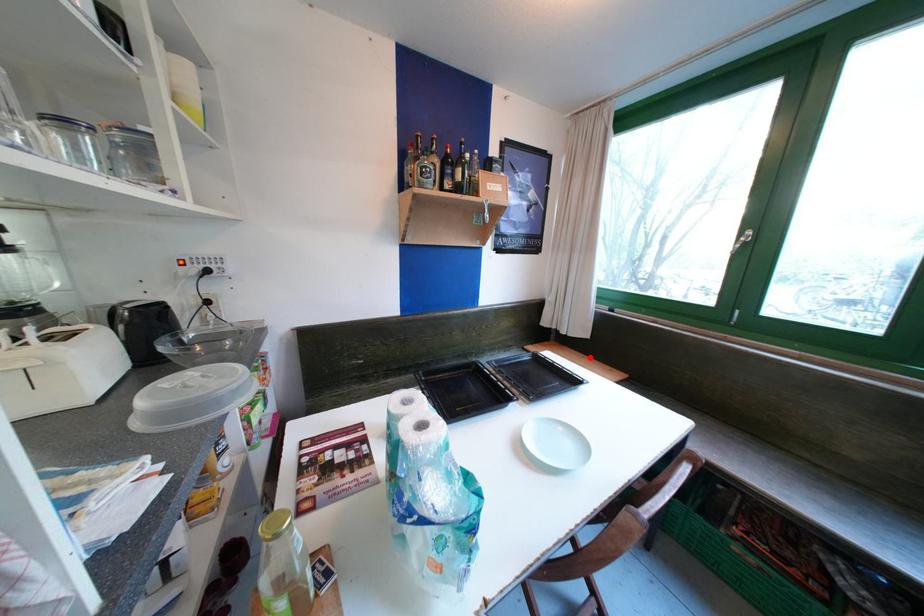
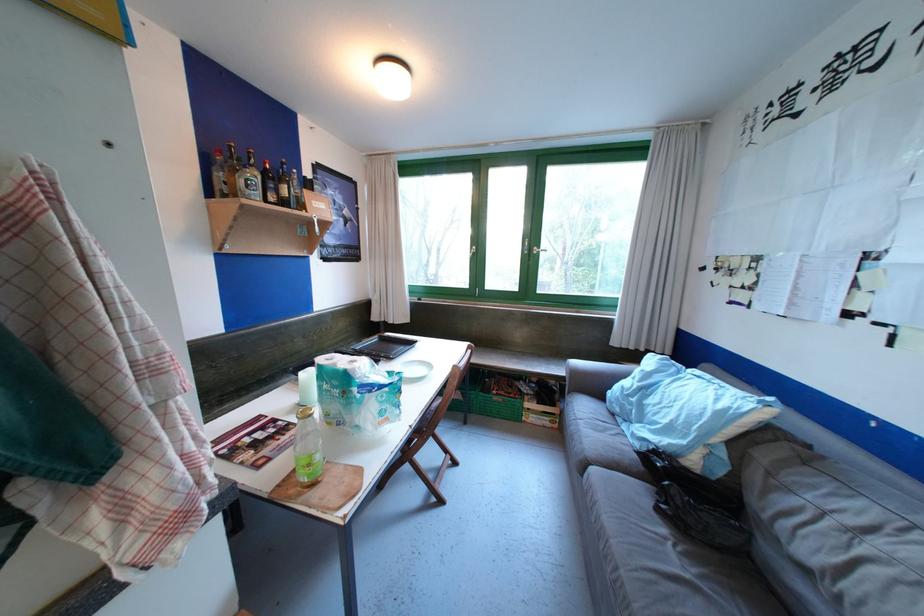
Question: I am providing you with two images of the same scene from different viewpoints. A red point is marked on the first image. Can you still see the location of the red point in image 2?

Choices:
 (A) Yes
 (B) No

Answer: (B)